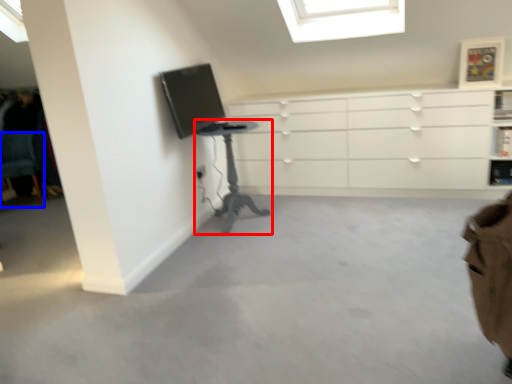
Question: Which object appears farthest to the camera in this image, table (highlighted by a red box) or computer chair (highlighted by a blue box)?

Choices:
 (A) table
 (B) computer chair

Answer: (B)